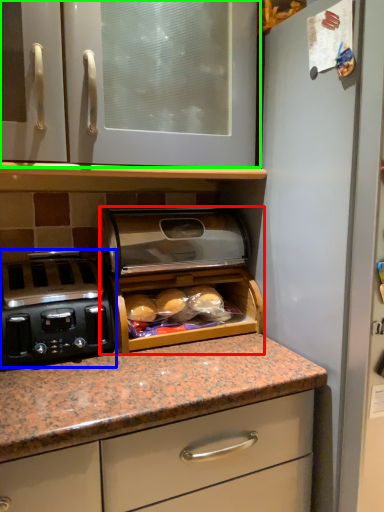
Question: Based on their relative distances, which object is farther from appliance (highlighted by a red box)? Choose from home appliance (highlighted by a blue box) and cabinetry (highlighted by a green box).

Choices:
 (A) home appliance
 (B) cabinetry

Answer: (B)